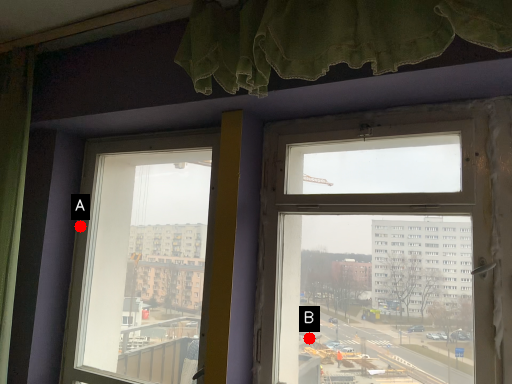
Question: Two points are circled on the image, labeled by A and B beside each circle. Which point appears farthest from the camera in this image?

Choices:
 (A) A is further
 (B) B is further

Answer: (A)